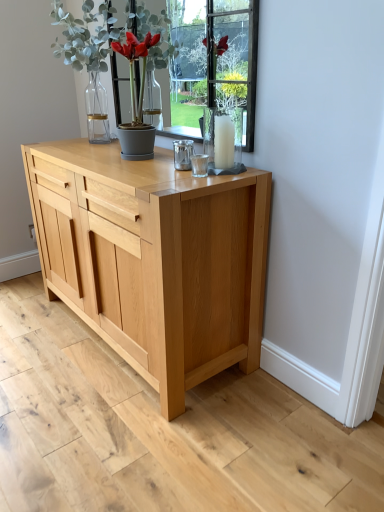
Identify the location of space that is in front of clear glass candle at center. (219, 176).